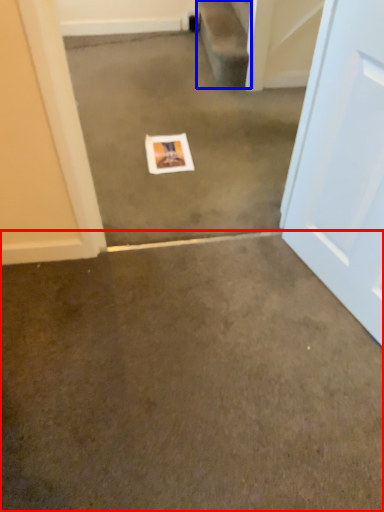
Question: Which object appears farthest to the camera in this image, concrete (highlighted by a red box) or stairwell (highlighted by a blue box)?

Choices:
 (A) concrete
 (B) stairwell

Answer: (B)